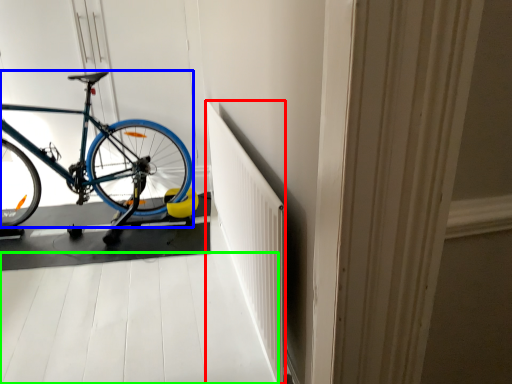
Question: Which object is positioned closest to radiator (highlighted by a red box)? Select from bicycle (highlighted by a blue box) and path (highlighted by a green box).

Choices:
 (A) bicycle
 (B) path

Answer: (B)